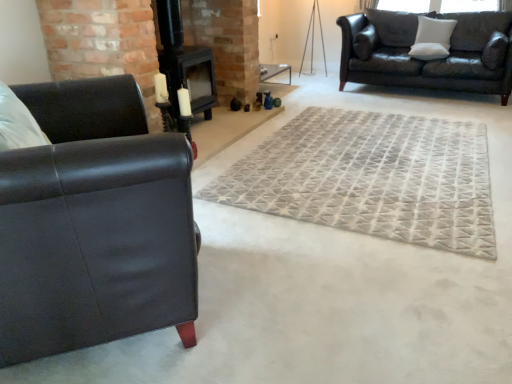
Question: Would you say matte black couch at upper right, acting as the 2th studio couch starting from the bottom, is to the left or to the right of white soft pillow at upper right, positioned as the first pillow in right-to-left order, in the picture?

Choices:
 (A) right
 (B) left

Answer: (B)

Question: Is matte black couch at upper right, the 1th studio couch positioned from the top, inside or outside of white soft pillow at upper right, positioned as the first pillow in right-to-left order?

Choices:
 (A) outside
 (B) inside

Answer: (A)

Question: Estimate the real-world distances between objects in this image. Which object is closer to the white soft cushion at upper right, which is counted as the first pillow, starting from the left?

Choices:
 (A) matte black leather couch at left, the 1th studio couch positioned from the bottom
 (B) white soft pillow at upper right, placed as the second pillow when sorted from left to right
 (C) gray textured rug at center
 (D) matte black couch at upper right, acting as the 2th studio couch starting from the bottom
 (E) black matte fireplace at center

Answer: (D)

Question: Considering the real-world distances, which object is farthest from the white soft pillow at upper right, positioned as the first pillow in right-to-left order?

Choices:
 (A) matte black couch at upper right, the 1th studio couch positioned from the top
 (B) gray textured rug at center
 (C) matte black leather couch at left, which appears as the second studio couch when viewed from the top
 (D) black matte fireplace at center
 (E) white soft cushion at upper right, which is counted as the first pillow, starting from the left

Answer: (C)